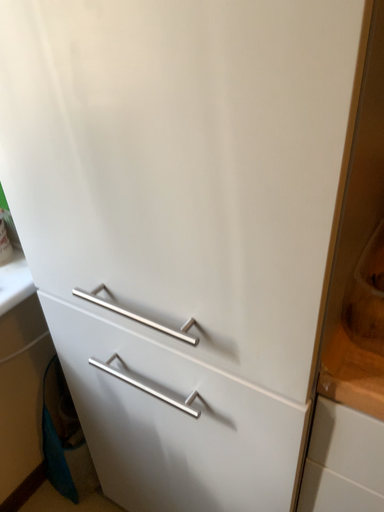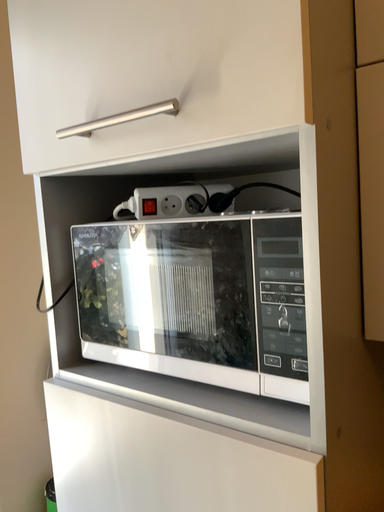
Question: How did the camera likely rotate when shooting the video?

Choices:
 (A) rotated upward
 (B) rotated downward

Answer: (A)